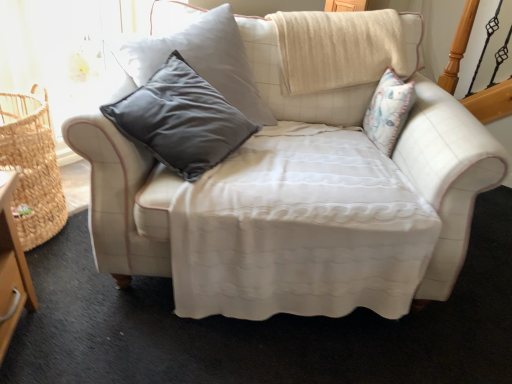
Question: Relative to white quilted fabric couch at center, is woven straw basket at left in front or behind?

Choices:
 (A) front
 (B) behind

Answer: (B)

Question: From a real-world perspective, is woven straw basket at left positioned above or below white quilted fabric couch at center?

Choices:
 (A) below
 (B) above

Answer: (A)

Question: Considering the positions of woven straw basket at left and white quilted fabric couch at center in the image, is woven straw basket at left taller or shorter than white quilted fabric couch at center?

Choices:
 (A) tall
 (B) short

Answer: (B)

Question: Is white quilted fabric couch at center taller or shorter than woven straw basket at left?

Choices:
 (A) short
 (B) tall

Answer: (B)

Question: Considering the positions of white quilted fabric couch at center and woven straw basket at left in the image, is white quilted fabric couch at center wider or thinner than woven straw basket at left?

Choices:
 (A) wide
 (B) thin

Answer: (A)

Question: Is white quilted fabric couch at center in front of or behind woven straw basket at left in the image?

Choices:
 (A) front
 (B) behind

Answer: (A)

Question: Do you think white quilted fabric couch at center is within woven straw basket at left, or outside of it?

Choices:
 (A) inside
 (B) outside

Answer: (B)